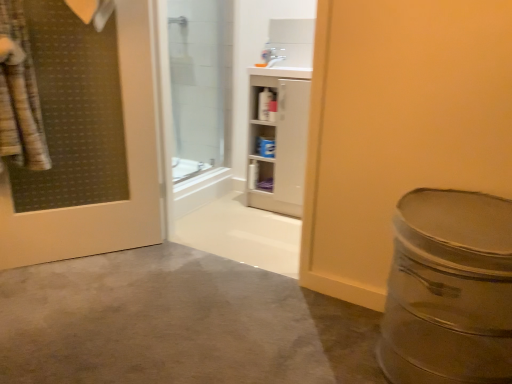
Question: Can you confirm if transparent glass shower door at upper center is positioned to the left of white glossy cabinet at upper center?

Choices:
 (A) no
 (B) yes

Answer: (B)

Question: From the image's perspective, is transparent glass shower door at upper center on white glossy cabinet at upper center?

Choices:
 (A) yes
 (B) no

Answer: (A)

Question: Is transparent glass shower door at upper center smaller than white glossy cabinet at upper center?

Choices:
 (A) no
 (B) yes

Answer: (A)

Question: Is transparent glass shower door at upper center behind white glossy cabinet at upper center?

Choices:
 (A) no
 (B) yes

Answer: (A)

Question: Is white glossy cabinet at upper center at the back of transparent glass shower door at upper center?

Choices:
 (A) no
 (B) yes

Answer: (B)

Question: Is transparent glass shower door at upper center beside white glossy cabinet at upper center?

Choices:
 (A) no
 (B) yes

Answer: (A)

Question: Is white glossy cabinet at center facing towards white glossy cabinet at upper center?

Choices:
 (A) no
 (B) yes

Answer: (B)

Question: Does white glossy cabinet at center appear on the right side of white glossy cabinet at upper center?

Choices:
 (A) yes
 (B) no

Answer: (A)

Question: From a real-world perspective, is white glossy cabinet at center physically above white glossy cabinet at upper center?

Choices:
 (A) yes
 (B) no

Answer: (B)

Question: Does white glossy cabinet at center lie in front of white glossy cabinet at upper center?

Choices:
 (A) no
 (B) yes

Answer: (B)

Question: Is white glossy cabinet at center not within white glossy cabinet at upper center?

Choices:
 (A) yes
 (B) no

Answer: (A)

Question: Does white glossy cabinet at center touch white glossy cabinet at upper center?

Choices:
 (A) no
 (B) yes

Answer: (A)

Question: Is white glossy cabinet at upper center turned away from transparent glass shower door at upper center?

Choices:
 (A) yes
 (B) no

Answer: (B)